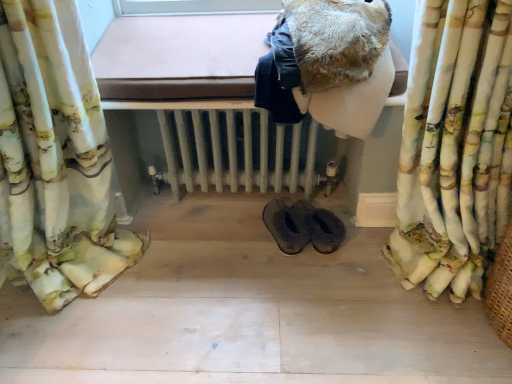
Question: Should I look upward or downward to see fuzzy brown blanket at upper center?

Choices:
 (A) down
 (B) up

Answer: (B)

Question: Is fuzzy brown blanket at upper center shorter than white painted radiator at center?

Choices:
 (A) no
 (B) yes

Answer: (B)

Question: Considering the relative sizes of fuzzy brown blanket at upper center and white painted radiator at center in the image provided, is fuzzy brown blanket at upper center thinner than white painted radiator at center?

Choices:
 (A) no
 (B) yes

Answer: (B)

Question: Is fuzzy brown blanket at upper center facing away from white painted radiator at center?

Choices:
 (A) no
 (B) yes

Answer: (A)

Question: Is fuzzy brown blanket at upper center further to camera compared to white painted radiator at center?

Choices:
 (A) yes
 (B) no

Answer: (B)

Question: Does fuzzy brown blanket at upper center appear on the left side of white painted radiator at center?

Choices:
 (A) no
 (B) yes

Answer: (A)

Question: From a real-world perspective, is fuzzy brown blanket at upper center positioned over white painted radiator at center based on gravity?

Choices:
 (A) yes
 (B) no

Answer: (A)

Question: From a real-world perspective, does white painted radiator at center stand above black leather slippers at center?

Choices:
 (A) no
 (B) yes

Answer: (B)

Question: Can you confirm if white painted radiator at center is positioned to the left of black leather slippers at center?

Choices:
 (A) no
 (B) yes

Answer: (B)

Question: Considering the relative positions of white painted radiator at center and black leather slippers at center in the image provided, is white painted radiator at center behind black leather slippers at center?

Choices:
 (A) no
 (B) yes

Answer: (A)

Question: Considering the relative sizes of white painted radiator at center and black leather slippers at center in the image provided, is white painted radiator at center smaller than black leather slippers at center?

Choices:
 (A) no
 (B) yes

Answer: (A)

Question: Considering the relative positions of white painted radiator at center and black leather slippers at center in the image provided, is white painted radiator at center to the right of black leather slippers at center from the viewer's perspective?

Choices:
 (A) no
 (B) yes

Answer: (A)

Question: Is white painted radiator at center in front of black leather slippers at center?

Choices:
 (A) yes
 (B) no

Answer: (A)

Question: Considering the relative sizes of black leather slippers at center and fuzzy brown blanket at upper center in the image provided, is black leather slippers at center thinner than fuzzy brown blanket at upper center?

Choices:
 (A) yes
 (B) no

Answer: (A)